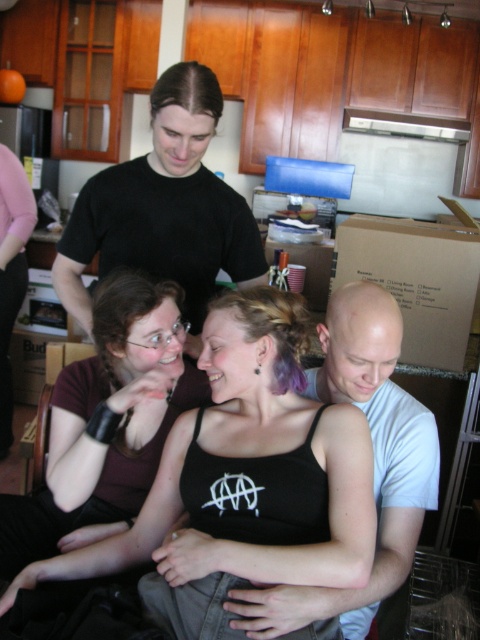
Can you confirm if black tank top at center is positioned below bald head at center?

Indeed, black tank top at center is positioned under bald head at center.

Based on the photo, does black tank top at center have a smaller size compared to bald head at center?

Incorrect, black tank top at center is not smaller in size than bald head at center.

Is point (175, 573) closer to viewer compared to point (343, 342)?

Yes, it is.

Where is `black tank top at center`? Image resolution: width=480 pixels, height=640 pixels. black tank top at center is located at coordinates (243, 481).

Which of these two, matte black tank top at center or black matte shirt at upper center, stands taller?

black matte shirt at upper center

Describe the element at coordinates (108, 419) in the screenshot. This screenshot has height=640, width=480. I see `matte black tank top at center` at that location.

Does point (132, 304) come farther from viewer compared to point (103, 180)?

No, it is not.

Locate an element on the screen. matte black tank top at center is located at coordinates (108, 419).

Does point (330, 509) lie in front of point (75, 380)?

Yes, point (330, 509) is in front of point (75, 380).

Looking at this image, does black tank top at center have a greater width compared to matte black tank top at center?

Yes, black tank top at center is wider than matte black tank top at center.

Which is in front, point (337, 541) or point (155, 291)?

Point (337, 541)

Locate an element on the screen. This screenshot has height=640, width=480. black tank top at center is located at coordinates (243, 481).